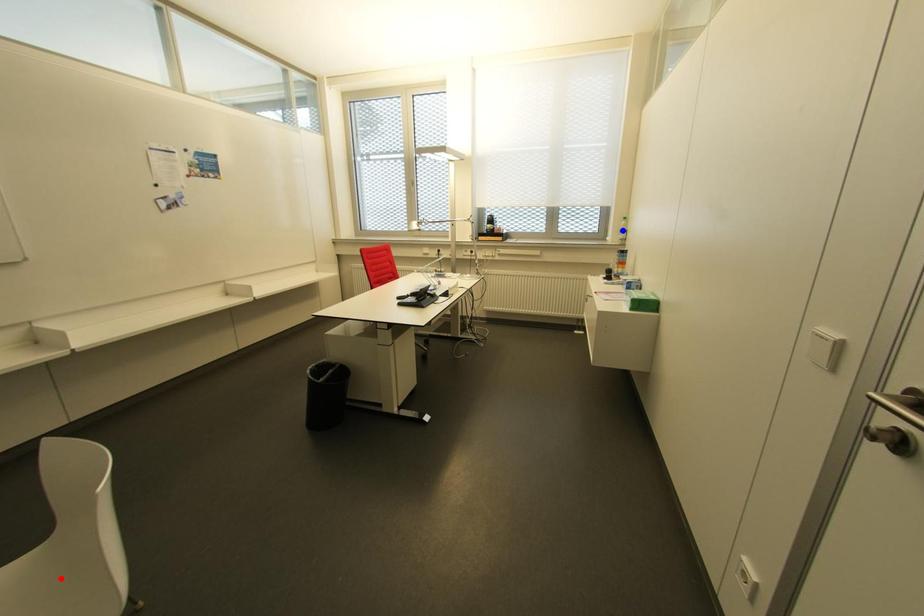
Question: Two points are marked on the image. Which point is closer to the camera?

Choices:
 (A) Blue point is closer.
 (B) Red point is closer.

Answer: (B)